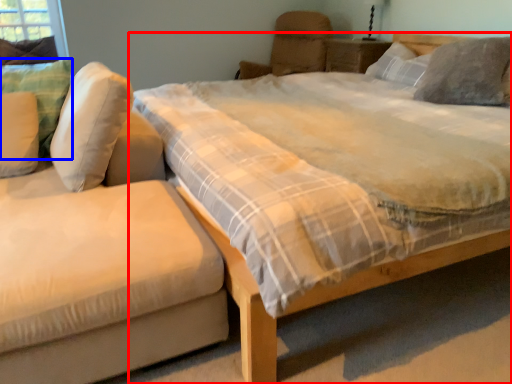
Question: Which object appears closest to the camera in this image, bed (highlighted by a red box) or pillow (highlighted by a blue box)?

Choices:
 (A) bed
 (B) pillow

Answer: (A)